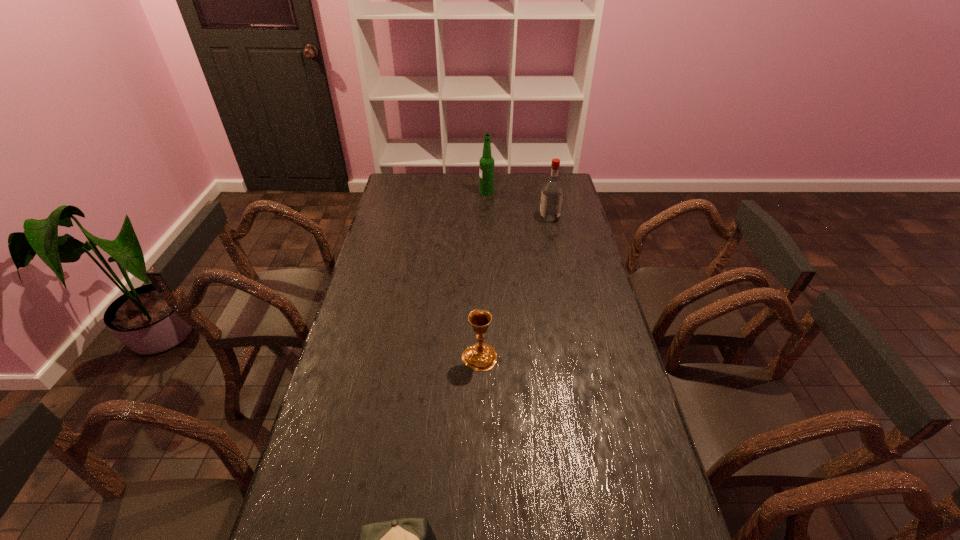
The width and height of the screenshot is (960, 540). Find the location of `beer bottle`. beer bottle is located at coordinates (486, 163).

This screenshot has height=540, width=960. I want to click on the second farthest object, so click(x=552, y=191).

This screenshot has width=960, height=540. What are the coordinates of `liquor` in the screenshot? It's located at (552, 191).

Image resolution: width=960 pixels, height=540 pixels. Find the location of `the third tallest object`. the third tallest object is located at coordinates (481, 357).

Where is `chalice`? chalice is located at coordinates (481, 357).

Image resolution: width=960 pixels, height=540 pixels. In order to click on vacant space located 0.050m on the label of the farthest object in this screenshot , I will do `click(469, 192)`.

This screenshot has width=960, height=540. In order to click on vacant space located 0.130m on the label of the farthest object in this screenshot , I will do `click(453, 192)`.

The image size is (960, 540). I want to click on vacant space located on the label of the farthest object, so click(451, 192).

At what (x,y) coordinates should I click in order to perform the action: click on vacant region located 0.290m on the front-facing side of the rightmost object. Please return your answer as a coordinate pair (x, y). The height and width of the screenshot is (540, 960). Looking at the image, I should click on [476, 218].

You are a GUI agent. You are given a task and a screenshot of the screen. Output one action in this format:
    pyautogui.click(x=<x>, y=<y>)
    Task: Click on the free space located on the front-facing side of the rightmost object
    
    Given the screenshot: What is the action you would take?
    pyautogui.click(x=493, y=218)